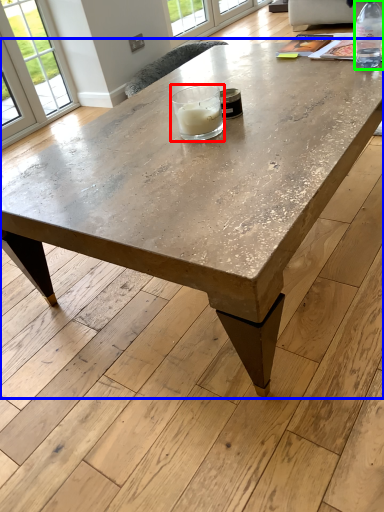
Question: Based on their relative distances, which object is nearer to candle holder (highlighted by a red box)? Choose from coffee table (highlighted by a blue box) and bottle (highlighted by a green box).

Choices:
 (A) coffee table
 (B) bottle

Answer: (A)